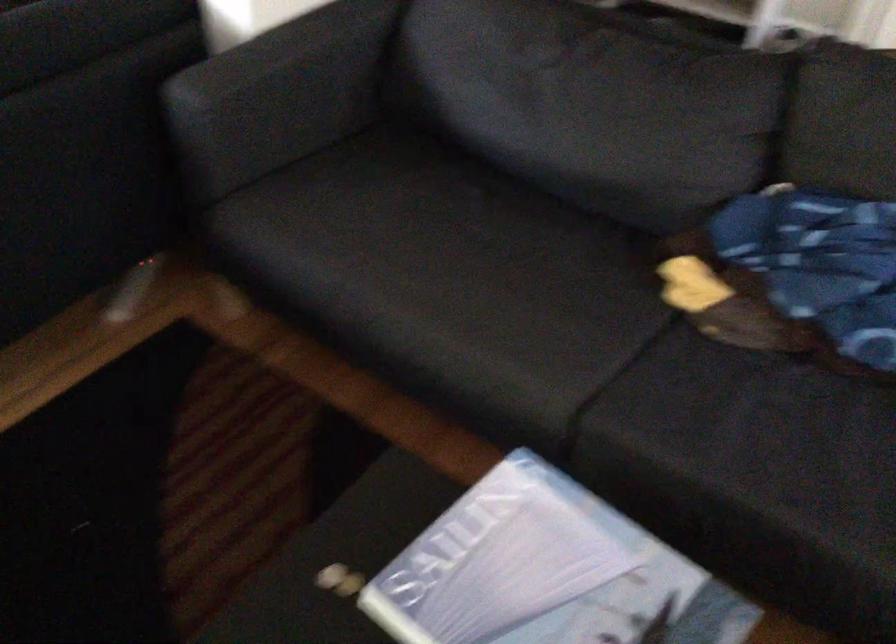
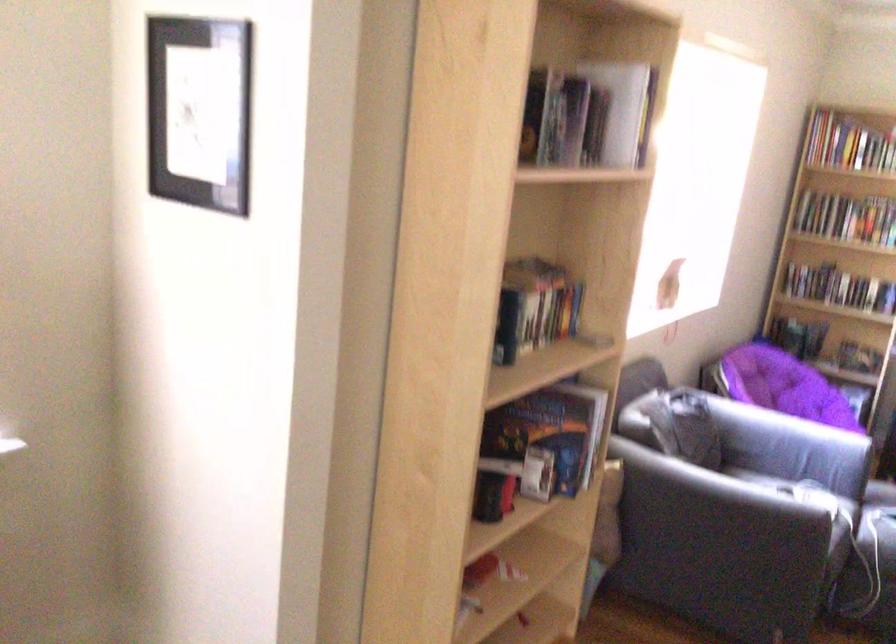
Question: How did the camera likely rotate?

Choices:
 (A) Left
 (B) Right
 (C) Up
 (D) Down

Answer: (A)